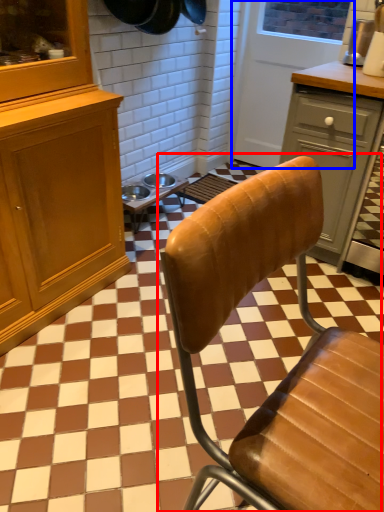
Question: Which point is further to the camera, chair (highlighted by a red box) or screen door (highlighted by a blue box)?

Choices:
 (A) chair
 (B) screen door

Answer: (B)